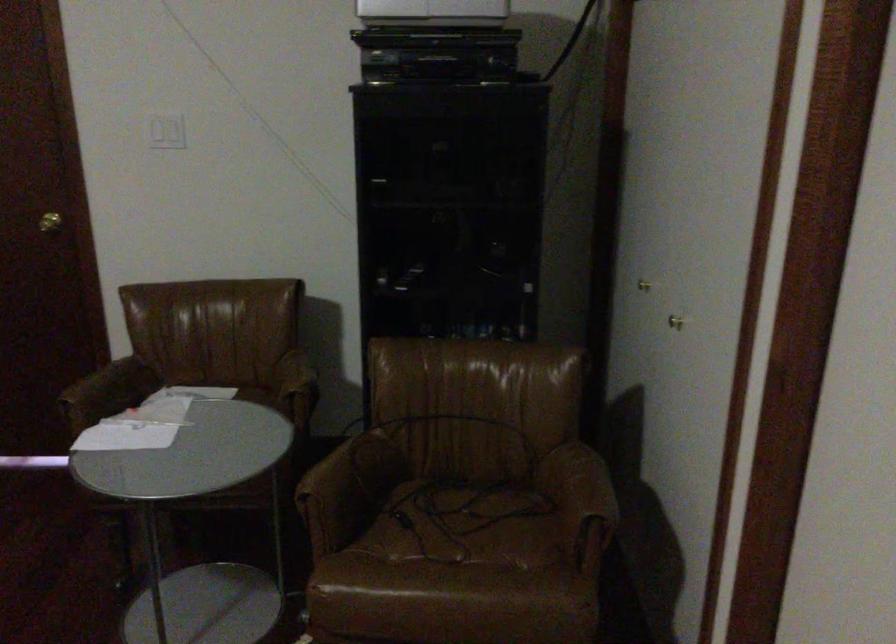
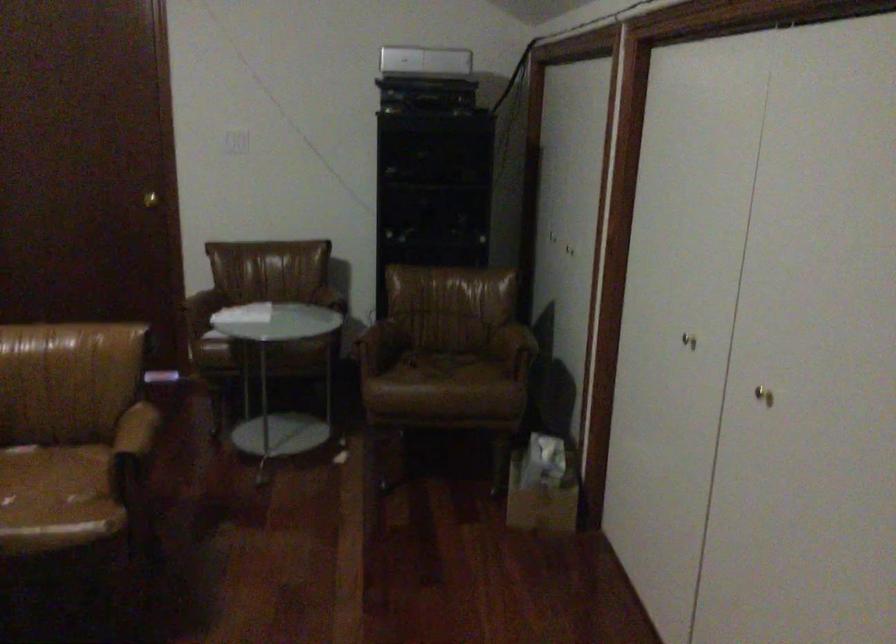
Question: The images are taken continuously from a first-person perspective. In which direction are you moving?

Choices:
 (A) Left
 (B) Right
 (C) Forward
 (D) Backward

Answer: (D)